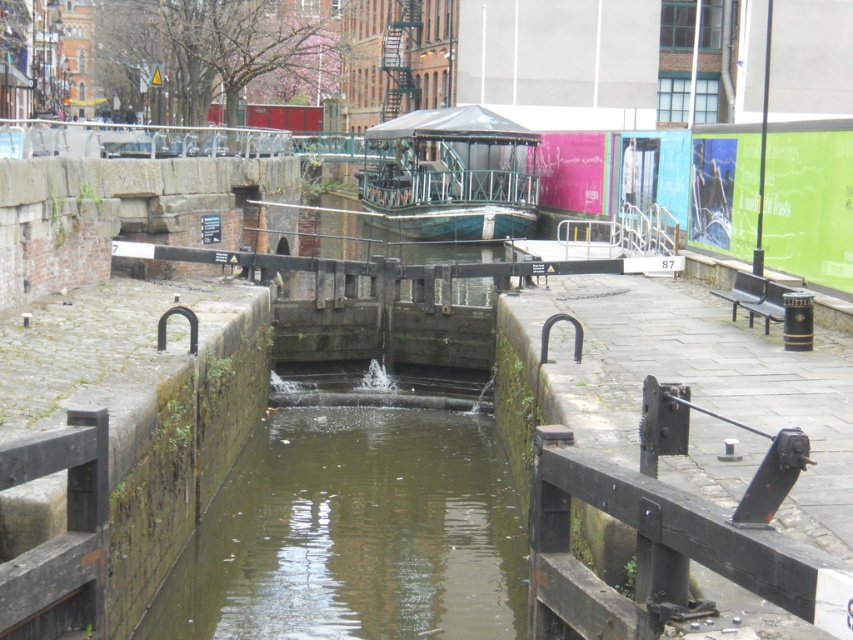
Question: Which object is farther from the camera taking this photo?

Choices:
 (A) greenish concrete water at center
 (B) green matte boat at center

Answer: (B)

Question: Which point is closer to the camera?

Choices:
 (A) (486, 168)
 (B) (248, 509)

Answer: (B)

Question: Which object is closer to the camera taking this photo?

Choices:
 (A) green matte boat at center
 (B) greenish concrete water at center

Answer: (B)

Question: Is greenish concrete water at center above green matte boat at center?

Choices:
 (A) no
 (B) yes

Answer: (A)

Question: Does greenish concrete water at center appear over green matte boat at center?

Choices:
 (A) yes
 (B) no

Answer: (B)

Question: Is greenish concrete water at center smaller than green matte boat at center?

Choices:
 (A) yes
 (B) no

Answer: (A)